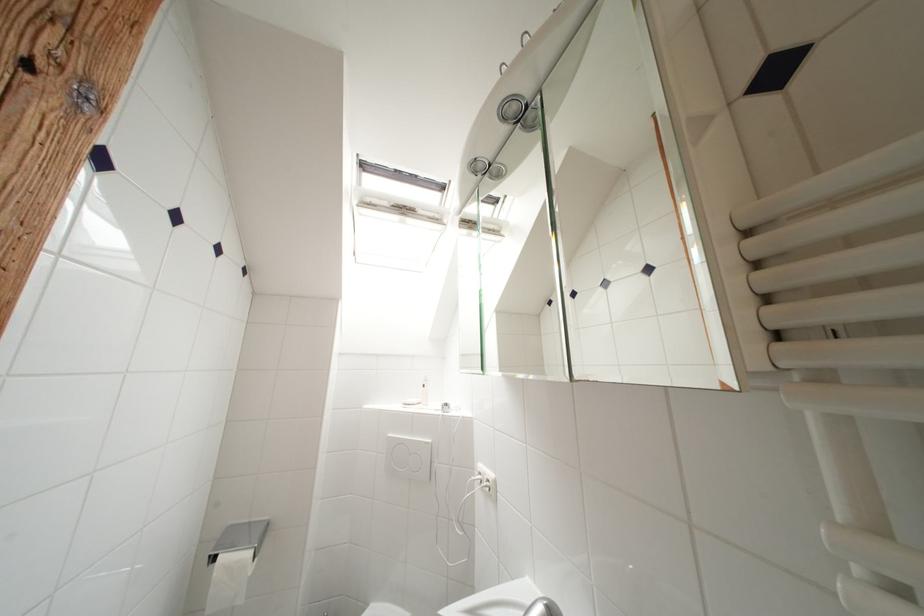
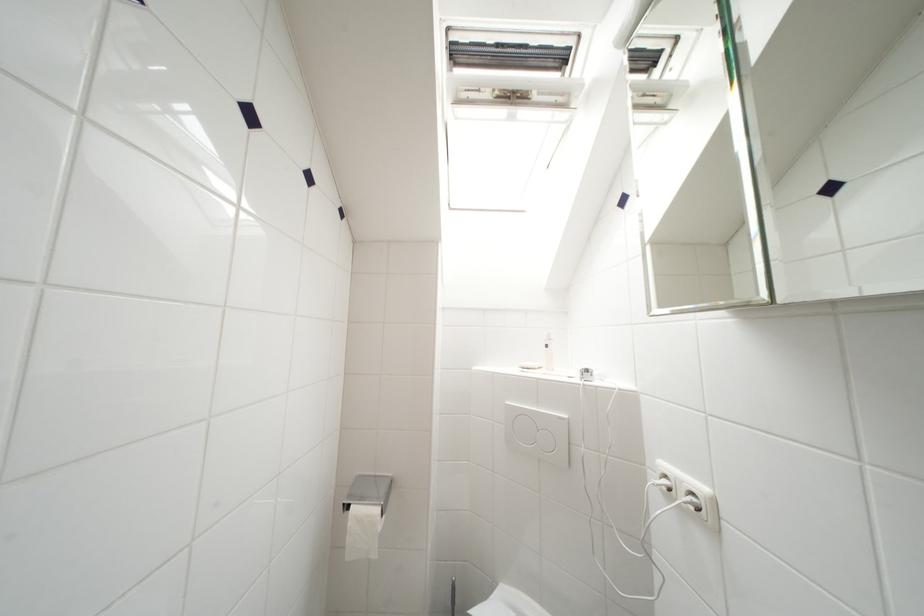
Locate, in the second image, the point that corresponds to point 494,484 in the first image.

(699, 498)